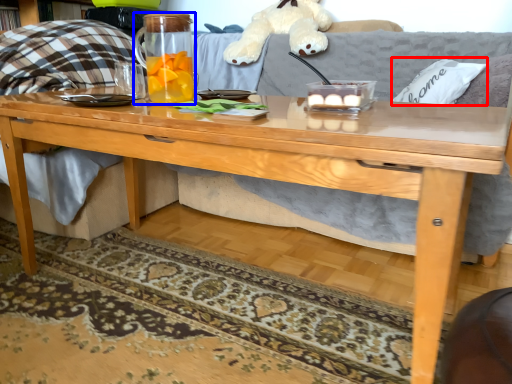
Question: Which of the following is the farthest to the observer, pillow (highlighted by a red box) or beverage (highlighted by a blue box)?

Choices:
 (A) pillow
 (B) beverage

Answer: (A)